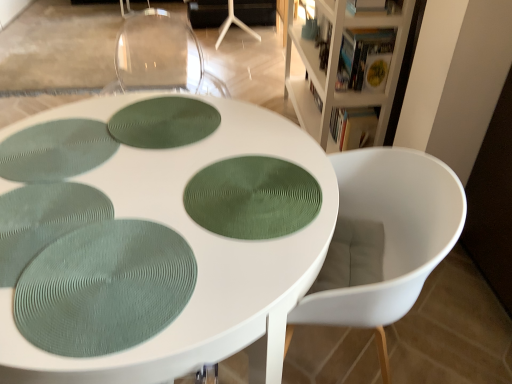
In order to click on free spot below green textured placemat at center, positioned as the second oval in top-to-bottom order (from a real-world perspective) in this screenshot , I will do `click(230, 192)`.